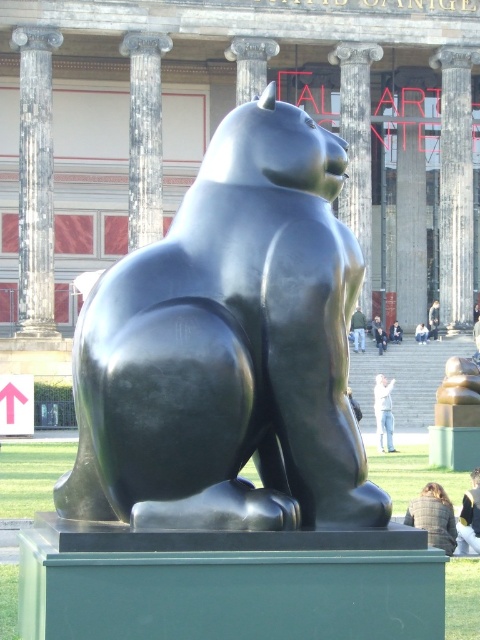
Question: Among these points, which one is farthest from the camera?

Choices:
 (A) (441, 316)
 (B) (422, 332)

Answer: (A)

Question: Is smooth gray column at center positioned in front of light gray concrete person at center?

Choices:
 (A) no
 (B) yes

Answer: (B)

Question: Can you confirm if smooth gray column at center is positioned to the right of light gray jeans at lower center?

Choices:
 (A) no
 (B) yes

Answer: (B)

Question: Which of these objects is positioned closest to the white cotton shirt at lower right?

Choices:
 (A) polished stone column at center
 (B) smooth gray stone pillar at center
 (C) smooth gray column at center

Answer: (A)

Question: Which of the following is the closest to the observer?

Choices:
 (A) polished marble column at center
 (B) white shirt at center

Answer: (B)

Question: Can you confirm if smooth gray stone pillar at center is positioned to the left of plaid wool jacket at lower right?

Choices:
 (A) no
 (B) yes

Answer: (A)